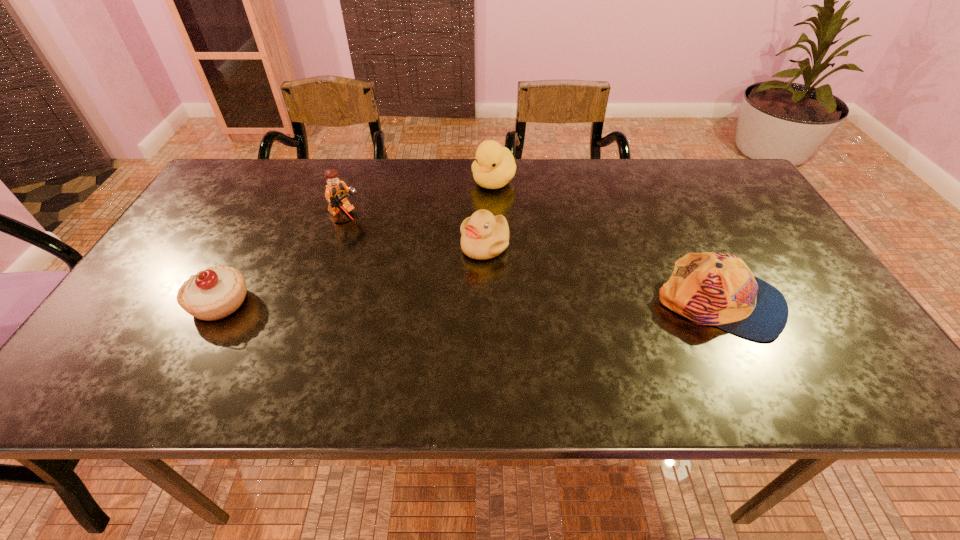
I want to click on free region located 0.260m on the beak of the duckling, so click(x=442, y=346).

In order to click on vacant space located on the beak of the duckling in this screenshot , I will do `click(449, 327)`.

At what (x,y) coordinates should I click in order to perform the action: click on vacant space located on the beak of the duckling. Please return your answer as a coordinate pair (x, y). Image resolution: width=960 pixels, height=540 pixels. Looking at the image, I should click on (468, 286).

Where is `free spot located 0.090m holding a crossbow in the hands of the second object from left to right`? free spot located 0.090m holding a crossbow in the hands of the second object from left to right is located at coordinates (383, 241).

Locate an element on the screen. vacant space located holding a crossbow in the hands of the second object from left to right is located at coordinates (427, 265).

Where is `vacant space located 0.270m holding a crossbow in the hands of the second object from left to right`? vacant space located 0.270m holding a crossbow in the hands of the second object from left to right is located at coordinates pyautogui.click(x=436, y=269).

Image resolution: width=960 pixels, height=540 pixels. Find the location of `duck that is at the far edge`. duck that is at the far edge is located at coordinates (494, 167).

You are a GUI agent. You are given a task and a screenshot of the screen. Output one action in this format:
    pyautogui.click(x=<x>, y=<y>)
    Task: Click on the Lego at the far edge
    This screenshot has width=960, height=540.
    Given the screenshot: What is the action you would take?
    pyautogui.click(x=336, y=191)

The image size is (960, 540). I want to click on pastry at the near edge, so click(212, 294).

The image size is (960, 540). I want to click on cap located at the near edge, so click(710, 288).